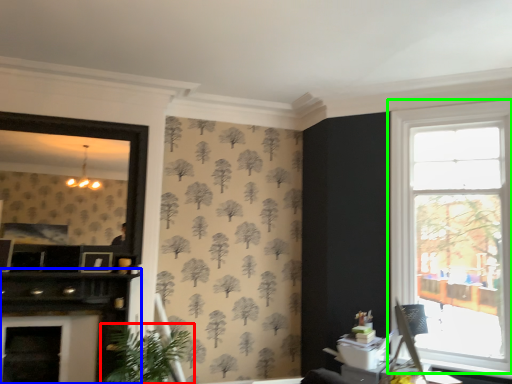
Question: Which object is positioned closest to houseplant (highlighted by a red box)? Select from dresser (highlighted by a blue box) and window (highlighted by a green box).

Choices:
 (A) dresser
 (B) window

Answer: (A)